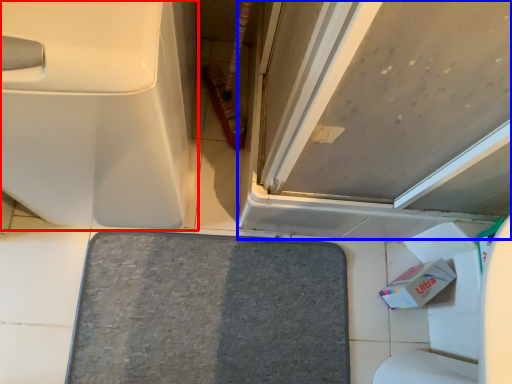
Question: Among these objects, which one is nearest to the camera, toilet (highlighted by a red box) or door (highlighted by a blue box)?

Choices:
 (A) toilet
 (B) door

Answer: (B)